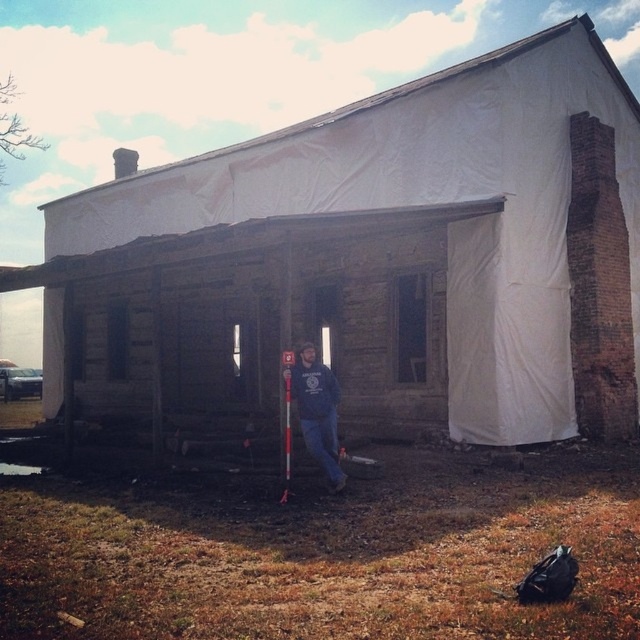
You are a construction worker standing at the entrance of the building. You notice the blue cotton shirt at center and the red plastic ski pole at center. Which object is located higher in the image?

The blue cotton shirt at center is positioned over the red plastic ski pole at center, so it is higher in the image.

You are planning to place a small decorative statue next to the wooden hut at center. Considering the size of the red plastic ski pole at center, will the statue fit comfortably without overcrowding the space?

The wooden hut at center is larger than the red plastic ski pole at center, so placing a small decorative statue next to the wooden hut at center should be feasible as there is enough space available.